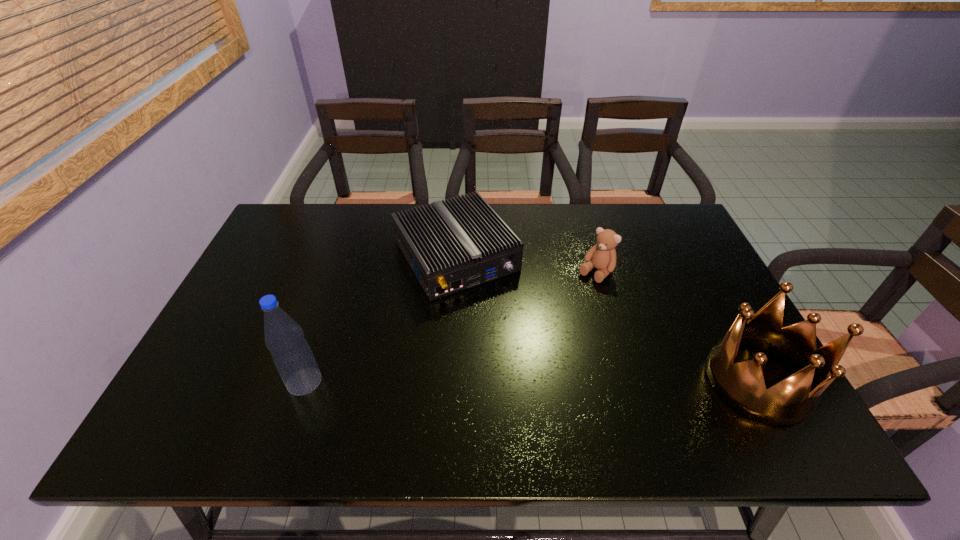
This screenshot has width=960, height=540. In order to click on the leftmost object in this screenshot , I will do `click(291, 353)`.

Find the location of a particular element. Image resolution: width=960 pixels, height=540 pixels. the tallest object is located at coordinates (291, 353).

The height and width of the screenshot is (540, 960). I want to click on crown, so click(x=742, y=385).

The image size is (960, 540). I want to click on the rightmost object, so click(x=742, y=385).

Where is `the third tallest object`? This screenshot has height=540, width=960. the third tallest object is located at coordinates (602, 256).

Identify the location of the third object from left to right. This screenshot has height=540, width=960. (602, 256).

The width and height of the screenshot is (960, 540). I want to click on the second object from left to right, so click(x=451, y=246).

Identify the location of the shortest object. (451, 246).

Image resolution: width=960 pixels, height=540 pixels. I want to click on vacant space located on the back of the water bottle, so click(347, 256).

Image resolution: width=960 pixels, height=540 pixels. Identify the location of vacant region located on the left of the rightmost object. (621, 380).